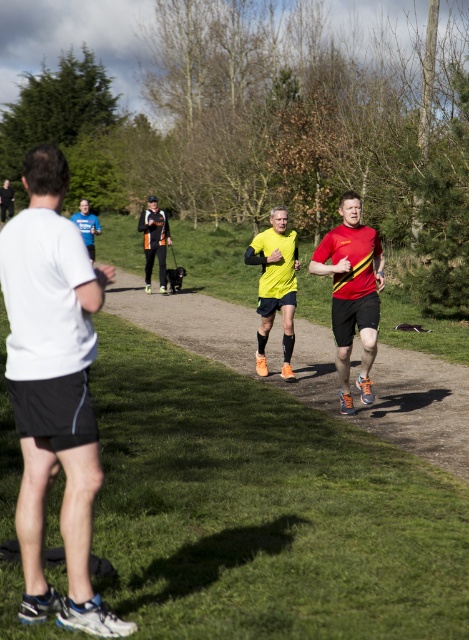
Question: Which point is closer to the camera?

Choices:
 (A) (334, 243)
 (B) (137, 282)

Answer: (A)

Question: Which point is closer to the camera?

Choices:
 (A) dirt path at center
 (B) yellow matte running shoe at center
 (C) red/yellow striped shirt at center

Answer: (A)

Question: Is dirt path at center behind red/yellow striped shirt at center?

Choices:
 (A) yes
 (B) no

Answer: (B)

Question: Observing the image, what is the correct spatial positioning of dirt path at center in reference to black fabric jacket at center?

Choices:
 (A) below
 (B) above

Answer: (A)

Question: Which object appears closest to the camera in this image?

Choices:
 (A) yellow matte running shoe at center
 (B) black fabric jacket at center
 (C) red/yellow striped shirt at center

Answer: (C)

Question: Does white matte shirt at left appear on the right side of yellow matte running shoe at center?

Choices:
 (A) yes
 (B) no

Answer: (B)